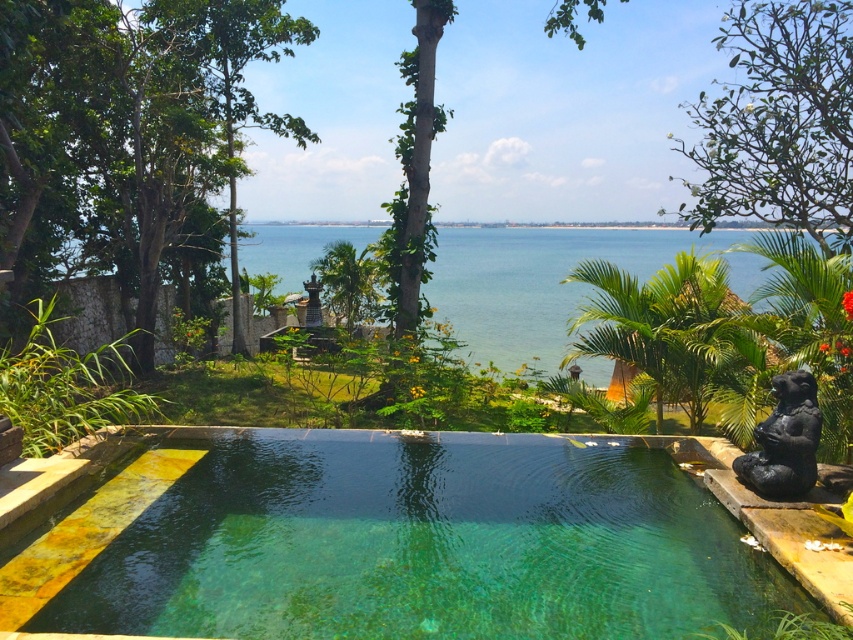
You are a maintenance worker tasked with cleaning the clear glass pool at center and the black stone statue at right. Your cleaning cart is parked 2 meters away from the pool. Can you reach both objects without moving the cart?

A: The clear glass pool at center is 1.09 meters from the black stone statue at right, so the distance between them is less than 2 meters. Since the cart is parked 2 meters away from the pool, you can reach both objects without moving the cart as they are within the 2 meter radius from the cart.

You are standing at the edge of the pool and want to place a small decorative item at one of the two points mentioned. Which point would be closer to you, point (461, 570) or point (299, 280)?

Point (461, 570) is closer to the viewer than point (299, 280), so placing the decorative item there would be closer to you.

You are a lifeguard standing at the edge of the clear glass pool at center. You notice a swimmer struggling near the black stone statue at right. Can you see the swimmer clearly from your current position?

The clear glass pool at center is not as tall as the black stone statue at right, so the statue may block your view of the swimmer depending on its height difference. However, since the pool is glass, you might still see through it but the statue could partially obstruct the view.